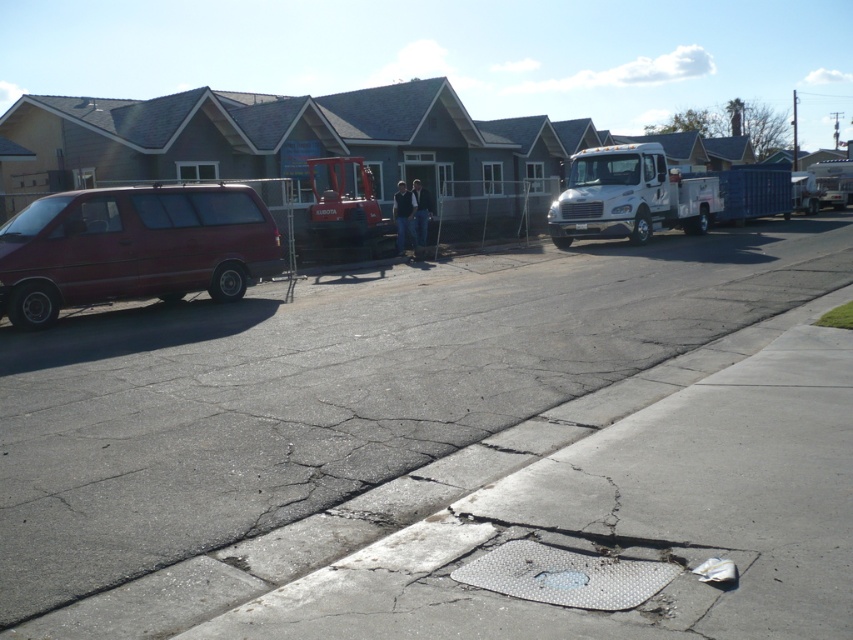
Question: Which point appears farthest from the camera in this image?

Choices:
 (A) (131, 205)
 (B) (593, 163)

Answer: (B)

Question: Can you confirm if matte red van at left is positioned above white metallic truck at center?

Choices:
 (A) no
 (B) yes

Answer: (A)

Question: Which object is farther from the camera taking this photo?

Choices:
 (A) matte red van at left
 (B) white metallic truck at center

Answer: (B)

Question: Where is matte red van at left located in relation to white metallic truck at center in the image?

Choices:
 (A) left
 (B) right

Answer: (A)

Question: Is matte red van at left wider than white metallic truck at center?

Choices:
 (A) yes
 (B) no

Answer: (B)